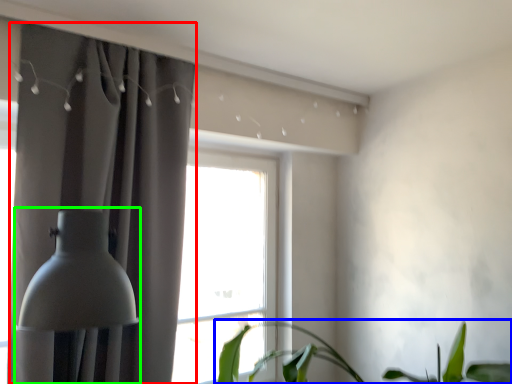
Question: Which is nearer to the curtain (highlighted by a red box)? houseplant (highlighted by a blue box) or table lamp (highlighted by a green box).

Choices:
 (A) houseplant
 (B) table lamp

Answer: (B)